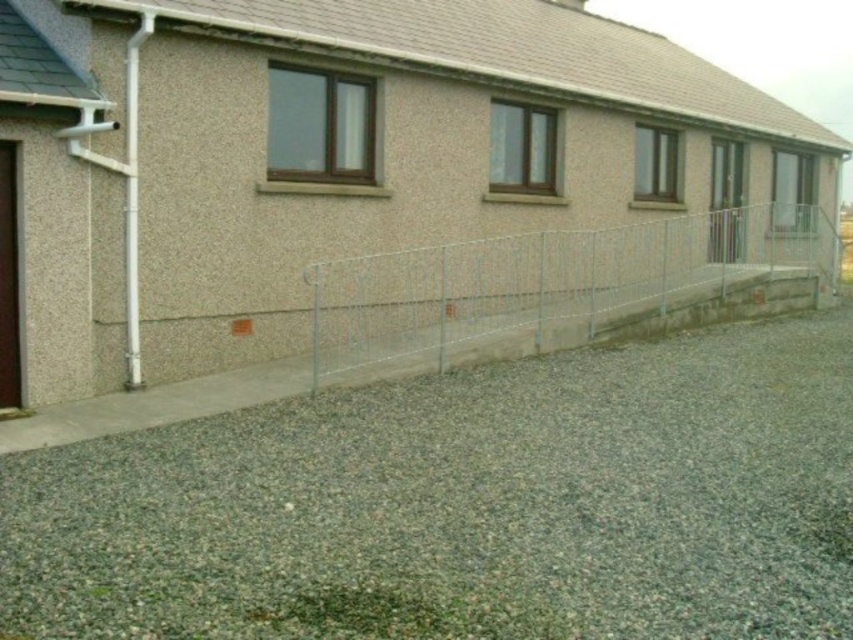
You are a gardener planning to plant a row of flowers between the gray gravel at lower center and the silver metallic fence at center. Based on the scene description, can you determine which side of the fence the flowers should be planted on?

The gray gravel at lower center is located below the silver metallic fence at center, so the flowers should be planted between the gravel and the fence, on the side of the fence facing the gravel.

You are a delivery person with a 10 feet wide truck. You need to park your truck between the silver metallic fence at center and the brown wooden door at left. Is there enough space for your truck to fit between them?

The silver metallic fence at center is 22.13 feet from the brown wooden door at left. Since your truck is 10 feet wide, there is sufficient space between them to park the truck.